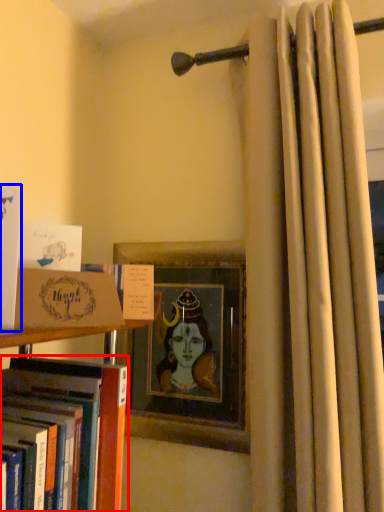
Question: Among these objects, which one is nearest to the camera, book (highlighted by a red box) or book (highlighted by a blue box)?

Choices:
 (A) book
 (B) book

Answer: (A)